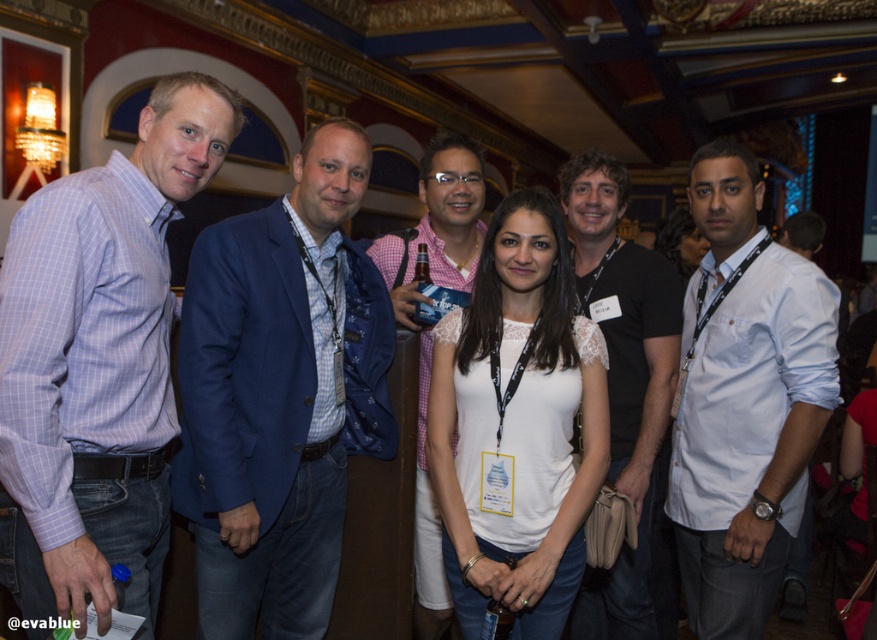
Question: Can you confirm if blue fabric jacket at center is thinner than pink checkered shirt at center?

Choices:
 (A) no
 (B) yes

Answer: (A)

Question: Among these points, which one is farthest from the camera?

Choices:
 (A) (272, 364)
 (B) (112, 276)
 (C) (404, 284)
 (D) (719, 496)

Answer: (C)

Question: Does white lace top at center appear over white cotton shirt at right?

Choices:
 (A) yes
 (B) no

Answer: (A)

Question: Does matte purple shirt at left appear over white cotton shirt at right?

Choices:
 (A) yes
 (B) no

Answer: (A)

Question: Which of the following is the closest to the observer?

Choices:
 (A) white lace top at center
 (B) blue fabric jacket at center

Answer: (A)

Question: Which point appears farthest from the camera in this image?

Choices:
 (A) (32, 355)
 (B) (431, 634)
 (C) (642, 292)
 (D) (571, 356)

Answer: (B)